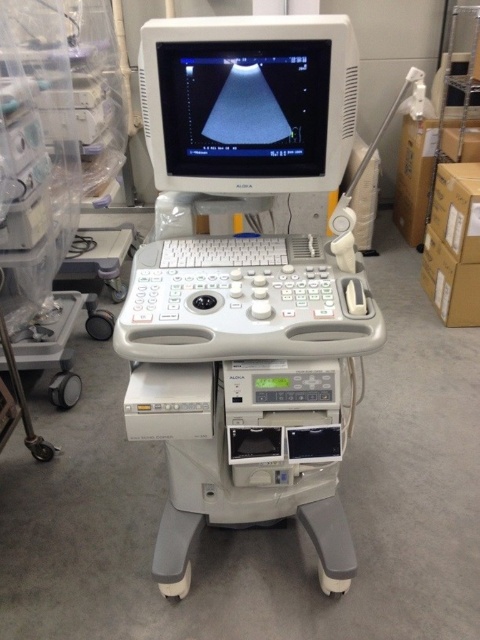
You are a medical technician who needs to move the white plastic ultrasound machine at center and the white plastic monitor at upper center to a different room. Based on their positions in the current setup, which object should you move first to avoid blocking access to the other?

The white plastic monitor at upper center is positioned above the white plastic ultrasound machine at center. Therefore, you should move the white plastic monitor at upper center first to avoid blocking access to the white plastic ultrasound machine at center during the move.

You are a technician who needs to locate the point at coordinates (247, 385) on the ALOKA ultrasound machine. Based on the description, where would this point be located?

The point at coordinates (247, 385) is on the white plastic ultrasound machine at center.

In the scene shown: You are a technician adjusting the ALOKA ultrasound machine. You need to reach both the point at coordinate (302,132) and the point at (263,17). Which coordinate is closer to you?

Point at coordinate (263,17) is closer to you because it is less further to the viewer than point at coordinate (302,132).